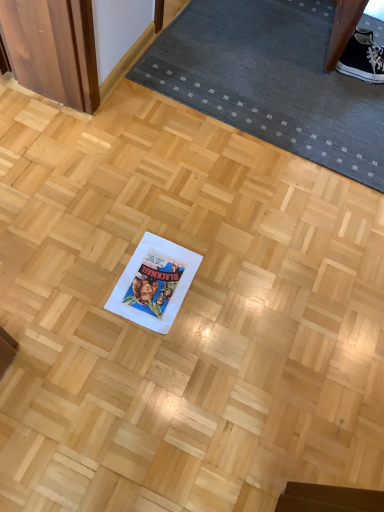
Locate an element on the screen. The width and height of the screenshot is (384, 512). vacant area that is in front of dark gray textured mat at upper center is located at coordinates (208, 197).